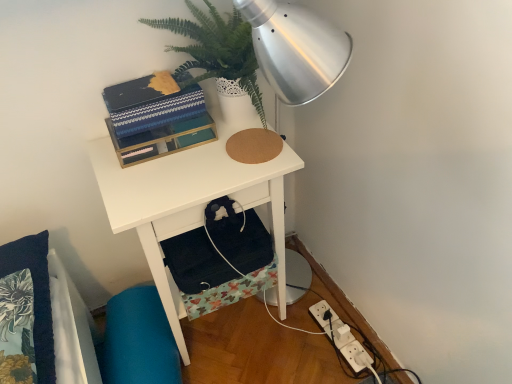
Question: Does green leafy plant at upper center have a lesser width compared to matte black book at upper center?

Choices:
 (A) no
 (B) yes

Answer: (A)

Question: Is the depth of green leafy plant at upper center less than that of matte black book at upper center?

Choices:
 (A) yes
 (B) no

Answer: (A)

Question: Is green leafy plant at upper center positioned with its back to matte black book at upper center?

Choices:
 (A) no
 (B) yes

Answer: (A)

Question: Is matte black book at upper center a part of green leafy plant at upper center?

Choices:
 (A) yes
 (B) no

Answer: (B)

Question: Considering the relative sizes of green leafy plant at upper center and matte black book at upper center in the image provided, is green leafy plant at upper center taller than matte black book at upper center?

Choices:
 (A) no
 (B) yes

Answer: (B)

Question: Considering the relative sizes of green leafy plant at upper center and matte black book at upper center in the image provided, is green leafy plant at upper center wider than matte black book at upper center?

Choices:
 (A) no
 (B) yes

Answer: (B)

Question: Does green leafy plant at upper center appear on the left side of white plastic power outlet at lower right?

Choices:
 (A) no
 (B) yes

Answer: (B)

Question: Is green leafy plant at upper center taller than white plastic power outlet at lower right?

Choices:
 (A) no
 (B) yes

Answer: (B)

Question: Does green leafy plant at upper center touch white plastic power outlet at lower right?

Choices:
 (A) no
 (B) yes

Answer: (A)

Question: Considering the relative sizes of green leafy plant at upper center and white plastic power outlet at lower right in the image provided, is green leafy plant at upper center wider than white plastic power outlet at lower right?

Choices:
 (A) no
 (B) yes

Answer: (A)

Question: From the image's perspective, is green leafy plant at upper center on white plastic power outlet at lower right?

Choices:
 (A) yes
 (B) no

Answer: (A)

Question: Is green leafy plant at upper center further to camera compared to white plastic power outlet at lower right?

Choices:
 (A) yes
 (B) no

Answer: (B)

Question: Considering the relative sizes of white matte desk at center and white plastic power outlet at lower right in the image provided, is white matte desk at center bigger than white plastic power outlet at lower right?

Choices:
 (A) no
 (B) yes

Answer: (B)